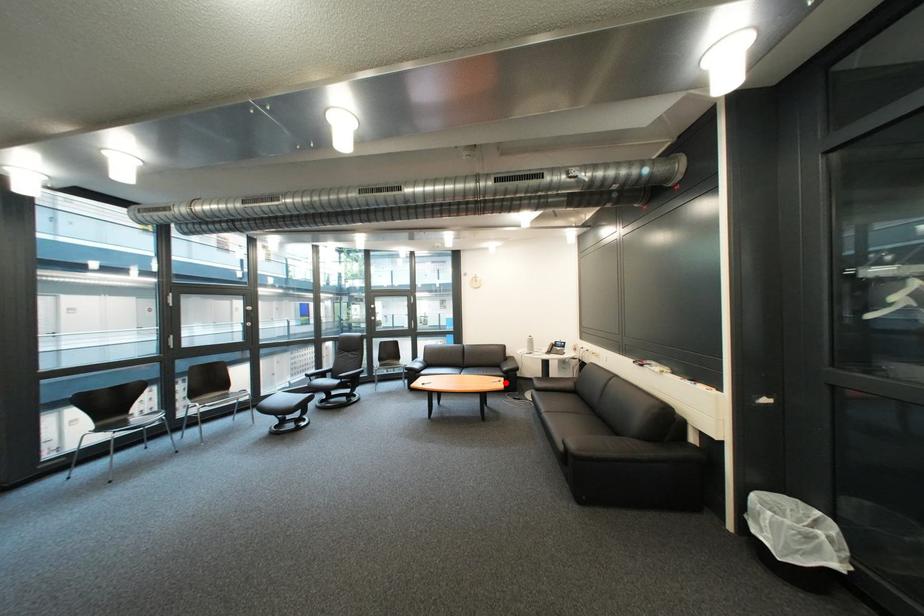
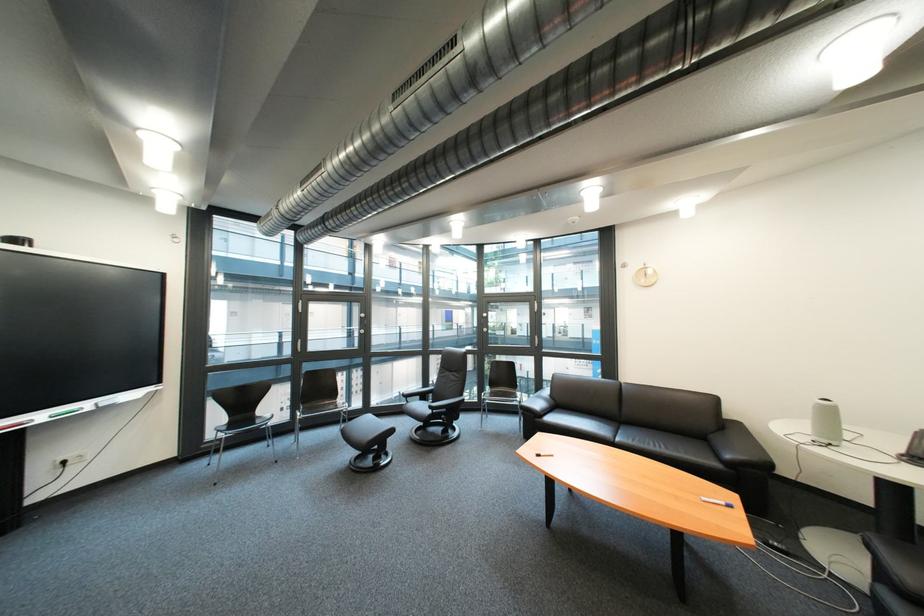
In the second image, find the point that corresponds to the highlighted location in the first image.

(718, 501)